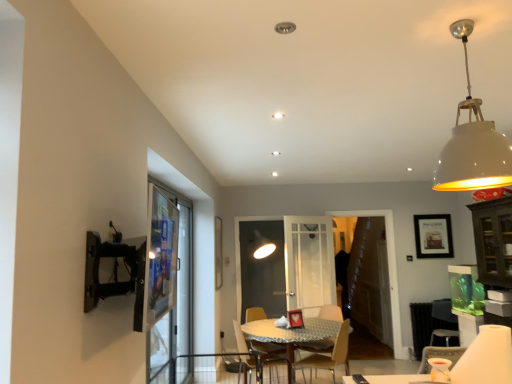
Question: Should I look upward or downward to see wooden table at center?

Choices:
 (A) down
 (B) up

Answer: (A)

Question: Considering the relative sizes of white matte lampshade at upper right and wooden chair at center, which is the second chair from left to right, in the image provided, is white matte lampshade at upper right smaller than wooden chair at center, which is the second chair from left to right,?

Choices:
 (A) yes
 (B) no

Answer: (A)

Question: Is white matte lampshade at upper right at the left side of wooden chair at center, which is the second chair from left to right?

Choices:
 (A) no
 (B) yes

Answer: (A)

Question: Is white matte lampshade at upper right beside wooden chair at center, which is the second chair from left to right?

Choices:
 (A) yes
 (B) no

Answer: (B)

Question: From a real-world perspective, is white matte lampshade at upper right located higher than wooden chair at center, which is the second chair from left to right?

Choices:
 (A) yes
 (B) no

Answer: (A)

Question: Can you confirm if white matte lampshade at upper right is shorter than wooden chair at center, which is the second chair from left to right?

Choices:
 (A) yes
 (B) no

Answer: (A)

Question: Is white matte lampshade at upper right oriented towards wooden chair at center, the first chair when ordered from right to left?

Choices:
 (A) yes
 (B) no

Answer: (B)

Question: Can you confirm if matte black picture frame at upper right is wider than wooden chair at center, the first chair when ordered from right to left?

Choices:
 (A) no
 (B) yes

Answer: (A)

Question: From a real-world perspective, is matte black picture frame at upper right located beneath wooden chair at center, the first chair when ordered from right to left?

Choices:
 (A) no
 (B) yes

Answer: (A)

Question: Is the surface of matte black picture frame at upper right in direct contact with wooden chair at center, which is the second chair from left to right?

Choices:
 (A) no
 (B) yes

Answer: (A)

Question: Is matte black picture frame at upper right positioned beyond the bounds of wooden chair at center, the first chair when ordered from right to left?

Choices:
 (A) no
 (B) yes

Answer: (B)

Question: Is wooden chair at center, the first chair when ordered from right to left, at the back of matte black picture frame at upper right?

Choices:
 (A) no
 (B) yes

Answer: (A)

Question: Is matte black picture frame at upper right further to the viewer compared to wooden chair at center, which is the second chair from left to right?

Choices:
 (A) yes
 (B) no

Answer: (A)

Question: Can you confirm if wooden chair at center, which is the second chair from left to right, is wider than matte black picture frame at upper right?

Choices:
 (A) no
 (B) yes

Answer: (B)